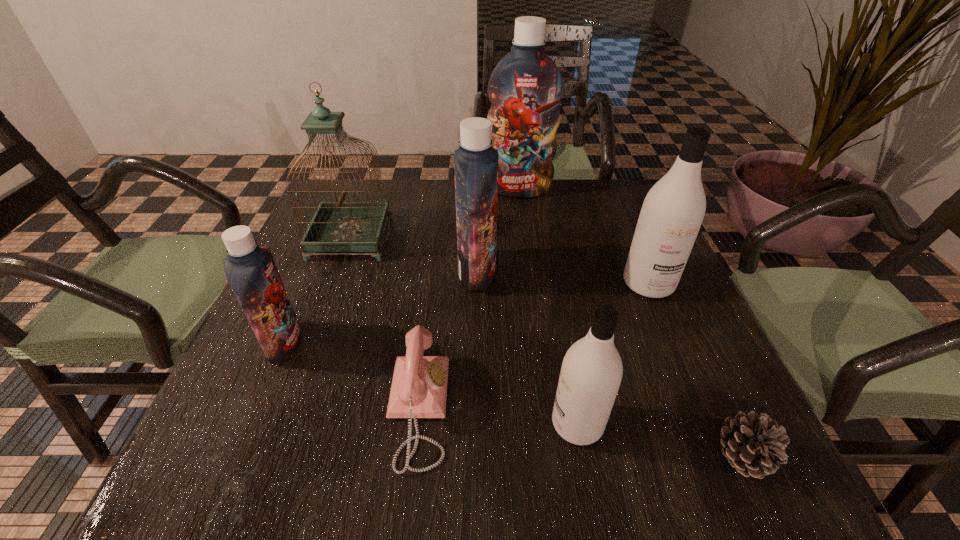
This screenshot has width=960, height=540. Find the location of `shampoo that is at the right edge`. shampoo that is at the right edge is located at coordinates (672, 213).

I want to click on pinecone located at the right edge, so click(x=755, y=445).

Locate an element on the screen. The width and height of the screenshot is (960, 540). object located in the far left corner section of the desktop is located at coordinates pyautogui.click(x=339, y=226).

You are a GUI agent. You are given a task and a screenshot of the screen. Output one action in this format:
    pyautogui.click(x=<x>, y=<y>)
    Task: Click on the object positioned at the near right corner
    
    Given the screenshot: What is the action you would take?
    pyautogui.click(x=755, y=445)

Image resolution: width=960 pixels, height=540 pixels. In the image, there is a desktop. Find the location of `free region at the far edge`. free region at the far edge is located at coordinates (586, 219).

Locate an element on the screen. free point at the right edge is located at coordinates (669, 323).

Image resolution: width=960 pixels, height=540 pixels. In order to click on blank space at the far right corner of the desktop in this screenshot , I will do `click(580, 185)`.

At what (x,y) coordinates should I click in order to perform the action: click on free spot between the tallest shampoo and the second farthest blue shampoo. Please return your answer as a coordinate pair (x, y). The height and width of the screenshot is (540, 960). Looking at the image, I should click on (498, 231).

Locate an element on the screen. vacant region between the tallest shampoo and the shortest object is located at coordinates (631, 323).

Where is `free space between the rightmost shampoo and the birdcage`? free space between the rightmost shampoo and the birdcage is located at coordinates (499, 261).